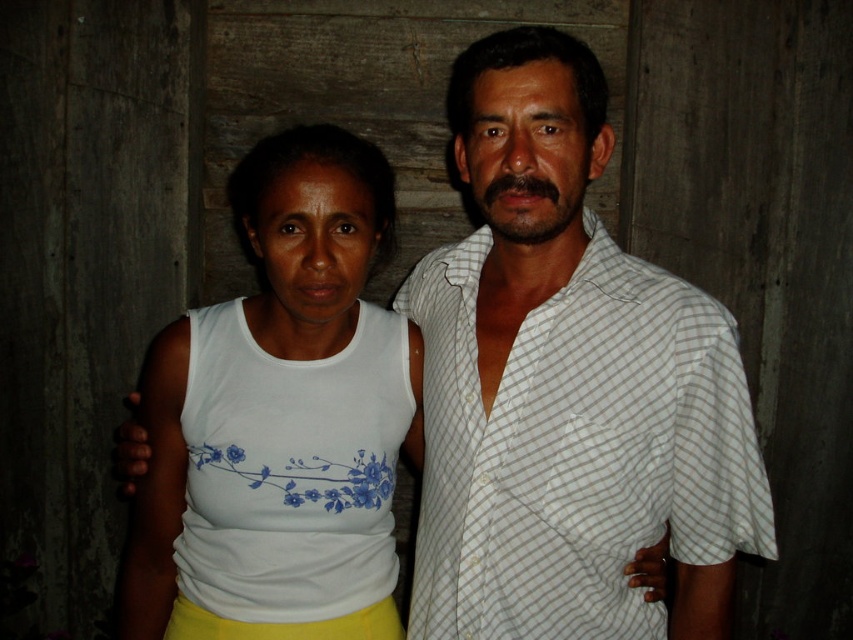
Can you confirm if white checkered shirt at right is thinner than white fabric tank top at center?

In fact, white checkered shirt at right might be wider than white fabric tank top at center.

Where is `white checkered shirt at right`? This screenshot has height=640, width=853. white checkered shirt at right is located at coordinates (576, 449).

Where is `white checkered shirt at right`? white checkered shirt at right is located at coordinates (576, 449).

Which is above, white cotton shirt at center or white fabric tank top at center?

white cotton shirt at center

Can you confirm if white cotton shirt at center is positioned below white fabric tank top at center?

No, white cotton shirt at center is not below white fabric tank top at center.

Is point (494, 401) more distant than point (338, 205)?

Yes, point (494, 401) is behind point (338, 205).

Find the location of `white cotton shirt at center`. white cotton shirt at center is located at coordinates (567, 385).

From the picture: Can you confirm if white cotton shirt at center is taller than white checkered shirt at right?

Correct, white cotton shirt at center is much taller as white checkered shirt at right.

Is point (483, 168) positioned before point (619, 513)?

That is True.

What do you see at coordinates (567, 385) in the screenshot? Image resolution: width=853 pixels, height=640 pixels. I see `white cotton shirt at center` at bounding box center [567, 385].

Image resolution: width=853 pixels, height=640 pixels. Identify the location of white cotton shirt at center. (567, 385).